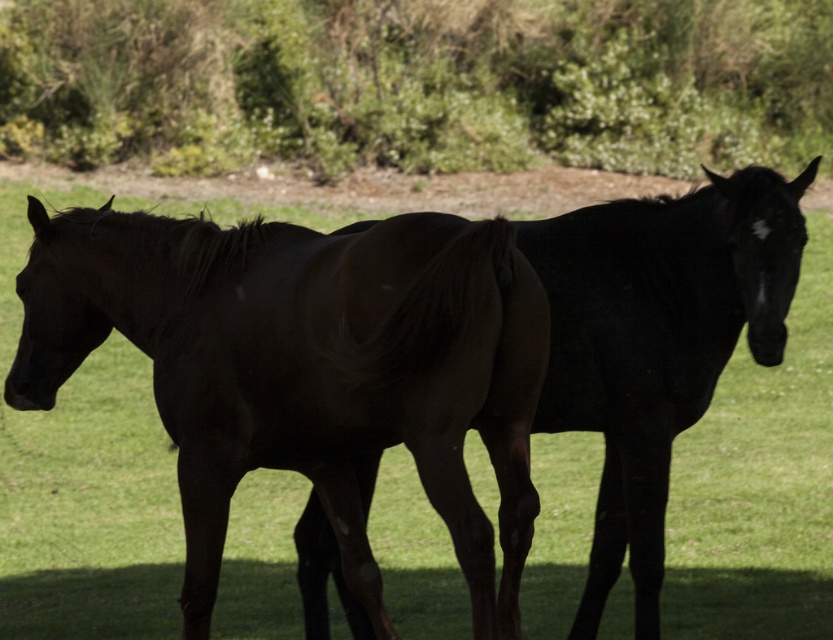
Question: From the image, what is the correct spatial relationship of green leafy bush at upper center in relation to shiny black horse at center?

Choices:
 (A) left
 (B) right

Answer: (A)

Question: Which point is closer to the camera?

Choices:
 (A) (337, 410)
 (B) (536, 419)

Answer: (A)

Question: Which point is farther to the camera?

Choices:
 (A) shiny black horse at center
 (B) shiny black horse at left

Answer: (A)

Question: Which object is the farthest from the shiny black horse at left?

Choices:
 (A) shiny black horse at center
 (B) green leafy bush at upper center

Answer: (B)

Question: Is green leafy bush at upper center further to the viewer compared to shiny black horse at left?

Choices:
 (A) no
 (B) yes

Answer: (B)

Question: Is green leafy bush at upper center smaller than shiny black horse at left?

Choices:
 (A) yes
 (B) no

Answer: (B)